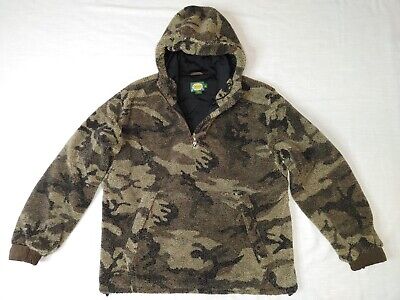
I want to click on hood, so click(197, 36).